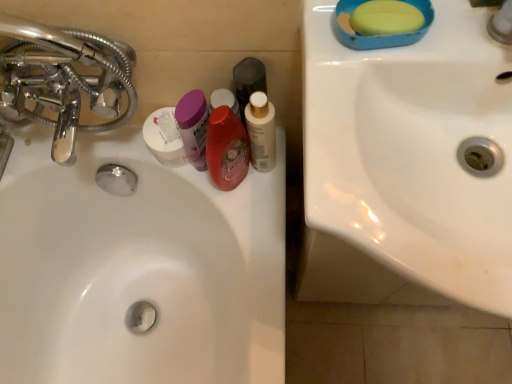
Identify the location of vacant space to the left of white matte container at center. This screenshot has height=384, width=512. (93, 147).